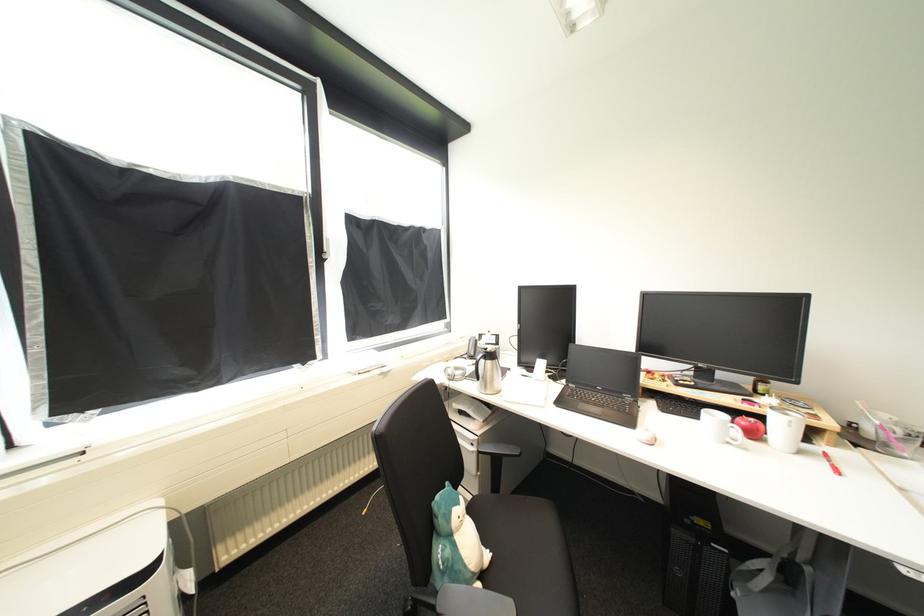
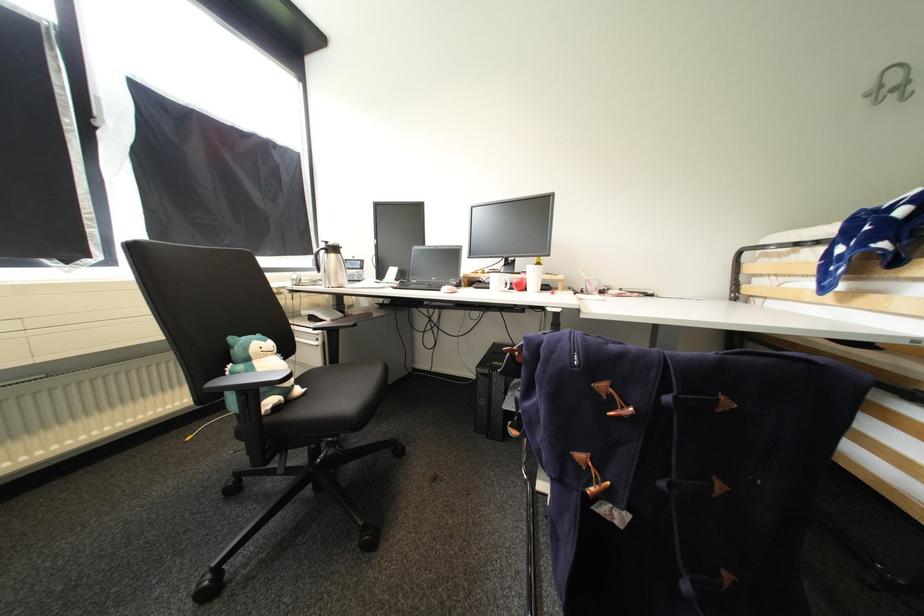
The point at (796, 427) is marked in the first image. Where is the corresponding point in the second image?

(541, 273)